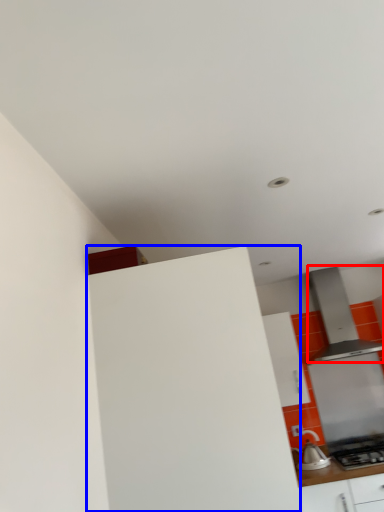
Question: Which object appears closest to the camera in this image, home appliance (highlighted by a red box) or cabinetry (highlighted by a blue box)?

Choices:
 (A) home appliance
 (B) cabinetry

Answer: (B)